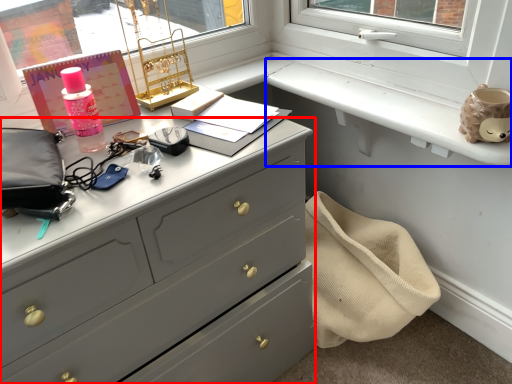
Question: Among these objects, which one is nearest to the camera, chest of drawers (highlighted by a red box) or window sill (highlighted by a blue box)?

Choices:
 (A) chest of drawers
 (B) window sill

Answer: (A)